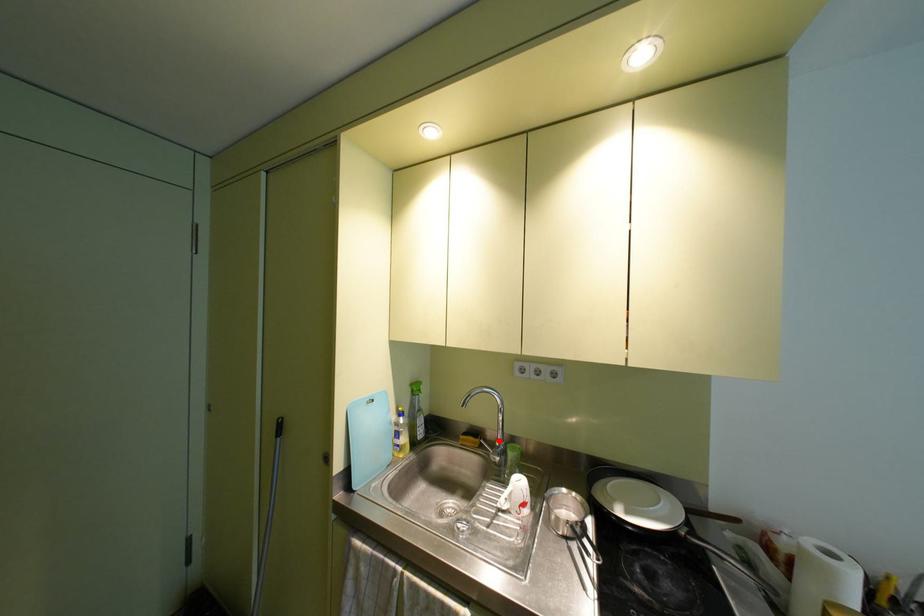
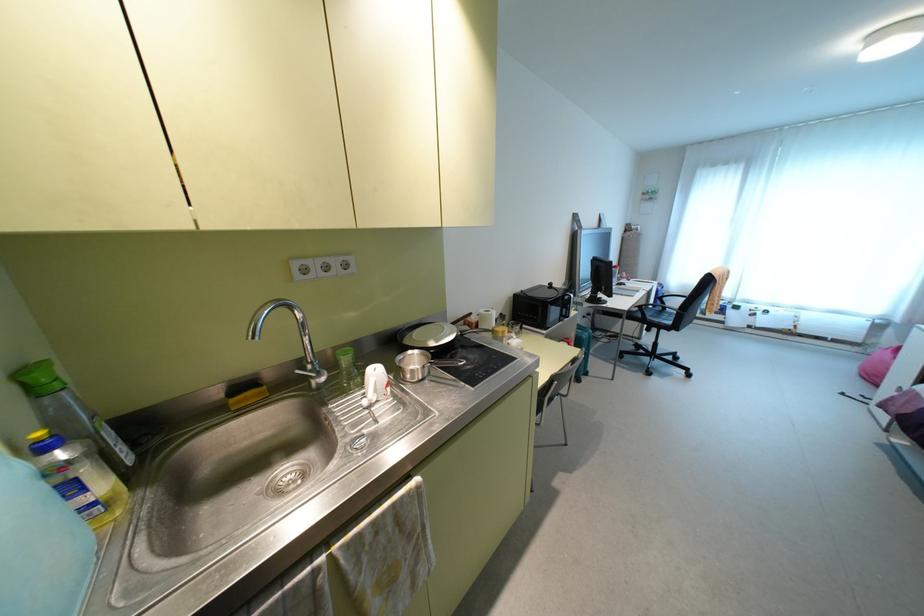
Where in the second image is the point corresponding to the highlighted location from the first image?

(310, 362)